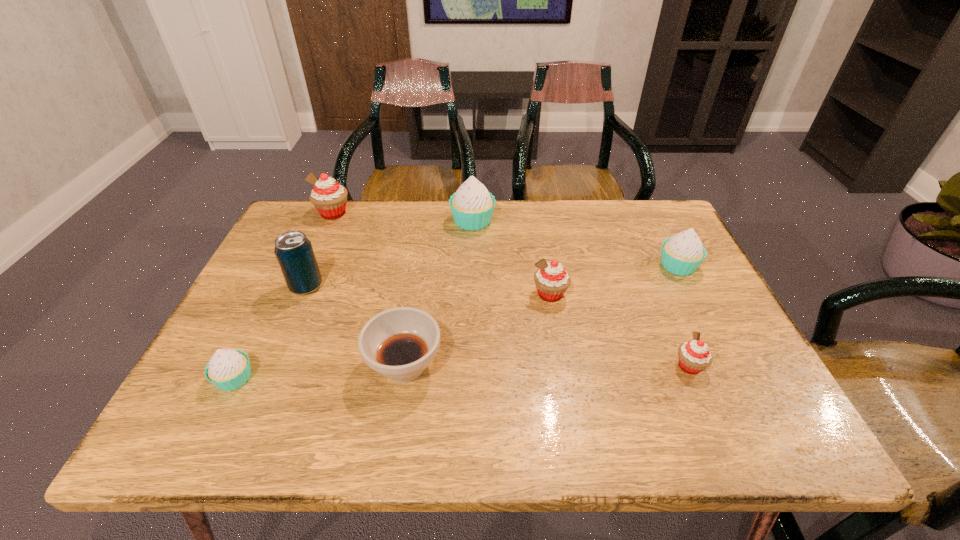
Find the location of `the leftmost pink cupcake`. the leftmost pink cupcake is located at coordinates (329, 197).

I want to click on the farthest pink cupcake, so click(x=329, y=197).

You are a GUI agent. You are given a task and a screenshot of the screen. Output one action in this format:
    pyautogui.click(x=<x>, y=<y>)
    Task: Click on the second white cupcake from left to right
    This screenshot has height=540, width=960.
    Given the screenshot: What is the action you would take?
    pyautogui.click(x=472, y=206)

This screenshot has height=540, width=960. Find the location of `the farthest white cupcake`. the farthest white cupcake is located at coordinates (472, 206).

Locate an element on the screen. soda can is located at coordinates (294, 252).

Find the location of a particular element. the fourth nearest cupcake is located at coordinates 683,253.

Find the location of a particular element. The height and width of the screenshot is (540, 960). the second smallest white cupcake is located at coordinates (683, 253).

This screenshot has width=960, height=540. Find the location of `the second biggest pink cupcake`. the second biggest pink cupcake is located at coordinates (x=551, y=279).

You are a GUI agent. You are given a task and a screenshot of the screen. Output one action in this format:
    pyautogui.click(x=<x>, y=<y>)
    Task: Click on the sixth object from left to right
    The height and width of the screenshot is (540, 960).
    Given the screenshot: What is the action you would take?
    pyautogui.click(x=551, y=279)

What are the coordinates of `soup bowl` in the screenshot? It's located at (399, 343).